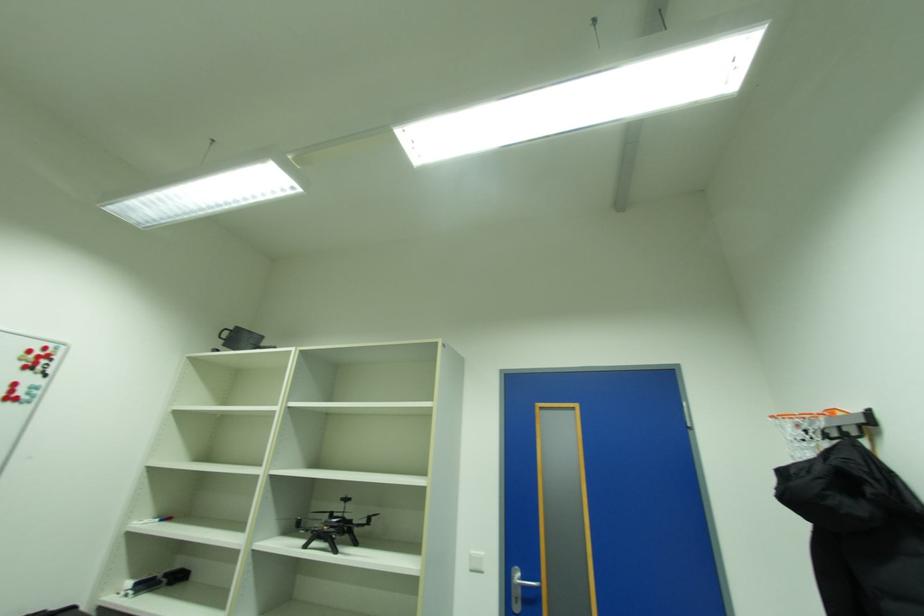
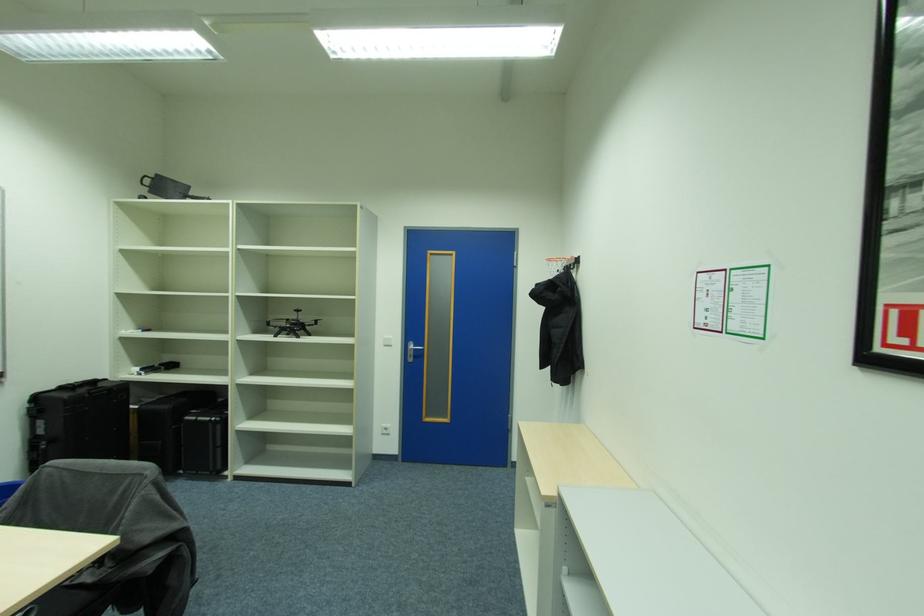
Question: What movement of the cameraman would produce the second image?

Choices:
 (A) Left
 (B) Right
 (C) Forward
 (D) Backward

Answer: (D)